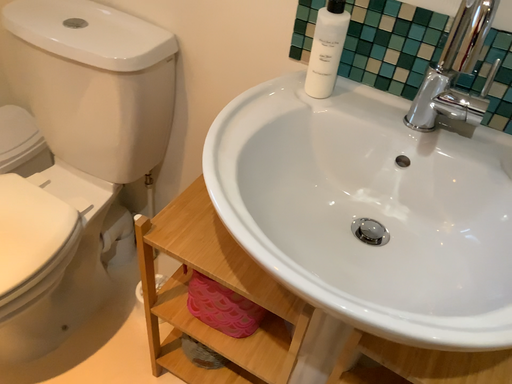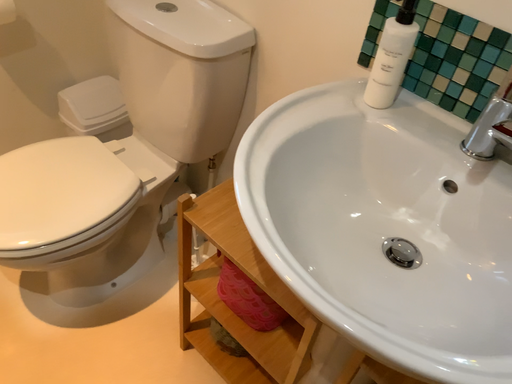
Question: Which way did the camera rotate in the video?

Choices:
 (A) rotated right
 (B) rotated left

Answer: (B)